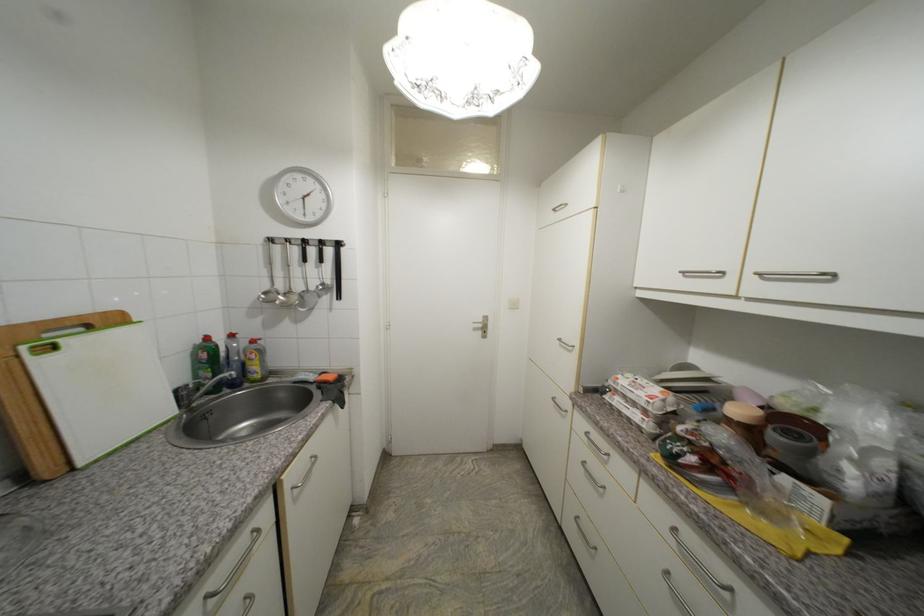
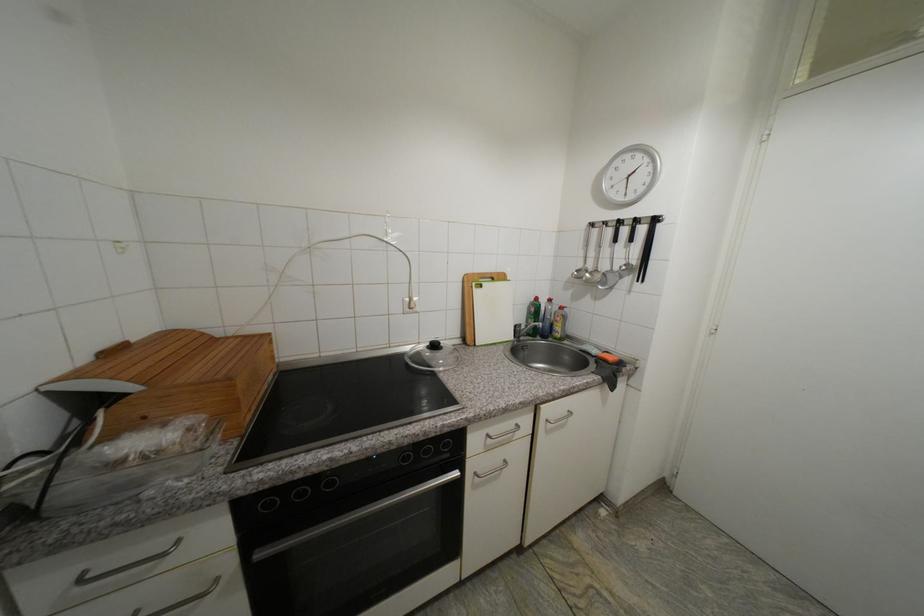
Question: The camera is either moving clockwise (left) or counter-clockwise (right) around the object. The first image is from the beginning of the video and the second image is from the end. Is the camera moving left or right when shooting the video?

Choices:
 (A) Left
 (B) Right

Answer: (B)